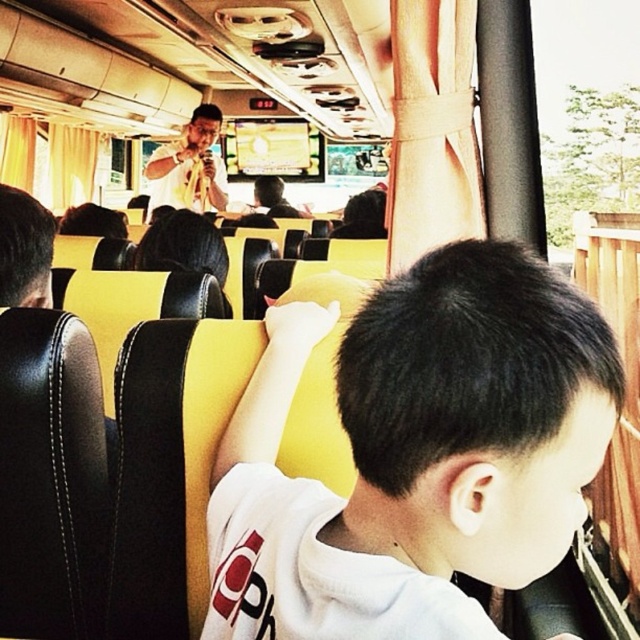
Who is more distant from viewer, (358, 326) or (168, 193)?

Point (168, 193)

Who is positioned more to the left, white matte shirt at center or matte yellow shirt at upper center?

From the viewer's perspective, matte yellow shirt at upper center appears more on the left side.

Does point (264, 426) come closer to viewer compared to point (202, 129)?

Yes, point (264, 426) is closer to viewer.

Find the location of a particular element. white matte shirt at center is located at coordinates (417, 454).